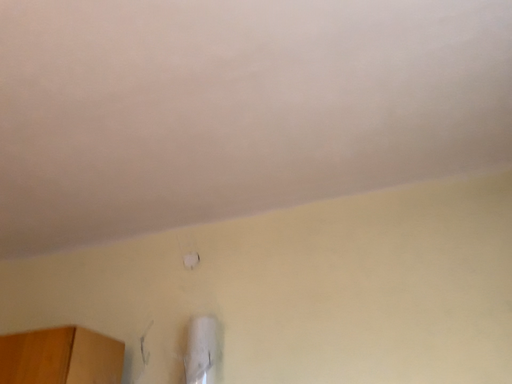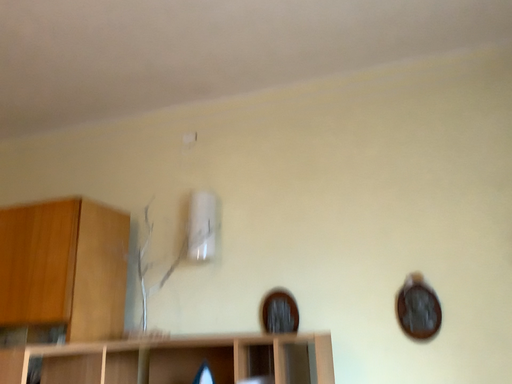
Question: Which way did the camera rotate in the video?

Choices:
 (A) rotated upward
 (B) rotated downward

Answer: (B)